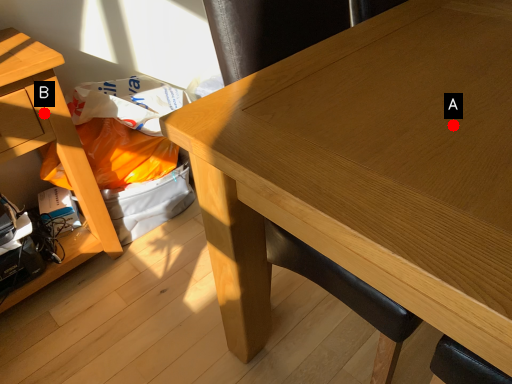
Question: Two points are circled on the image, labeled by A and B beside each circle. Which point is farther from the camera taking this photo?

Choices:
 (A) A is further
 (B) B is further

Answer: (B)